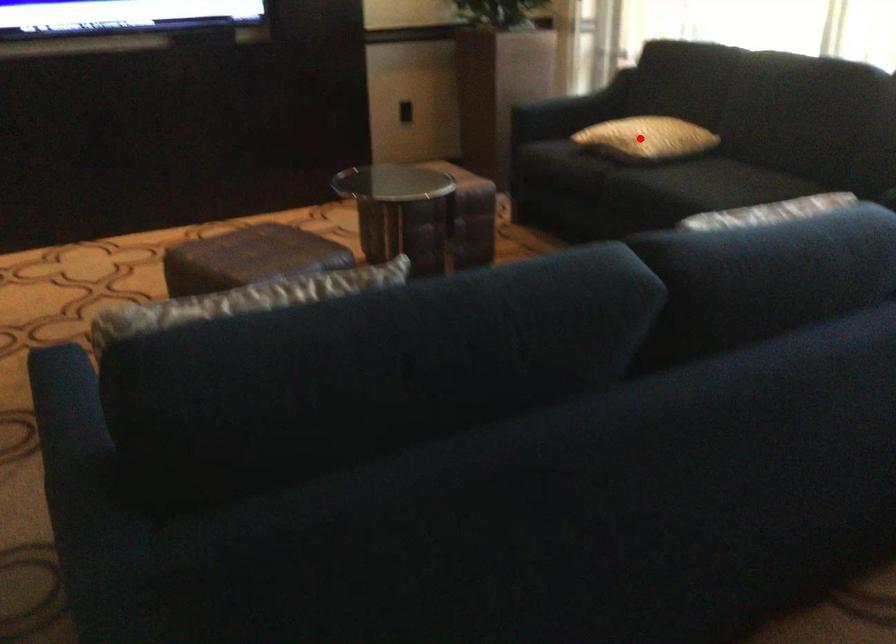
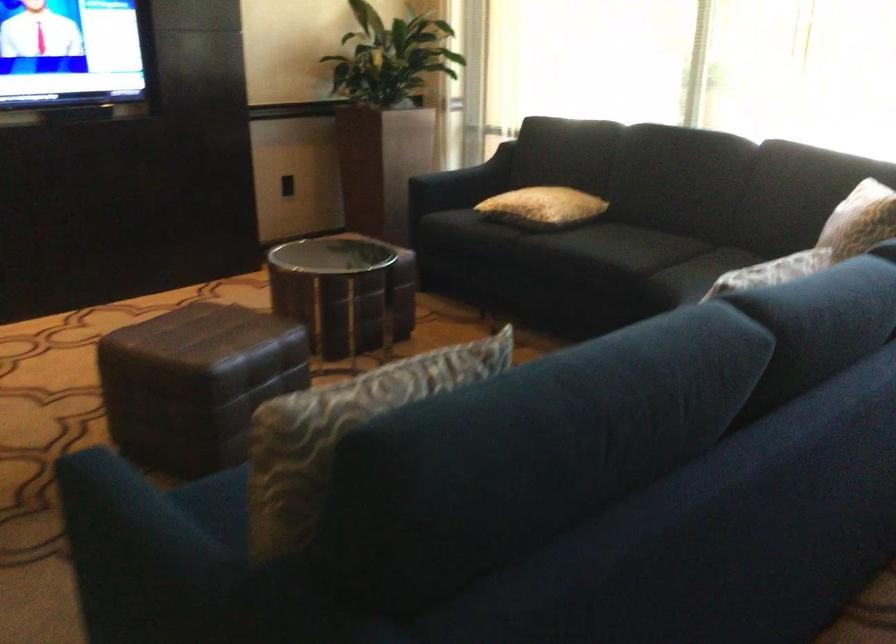
The point at the highlighted location is marked in the first image. Where is the corresponding point in the second image?

(543, 207)